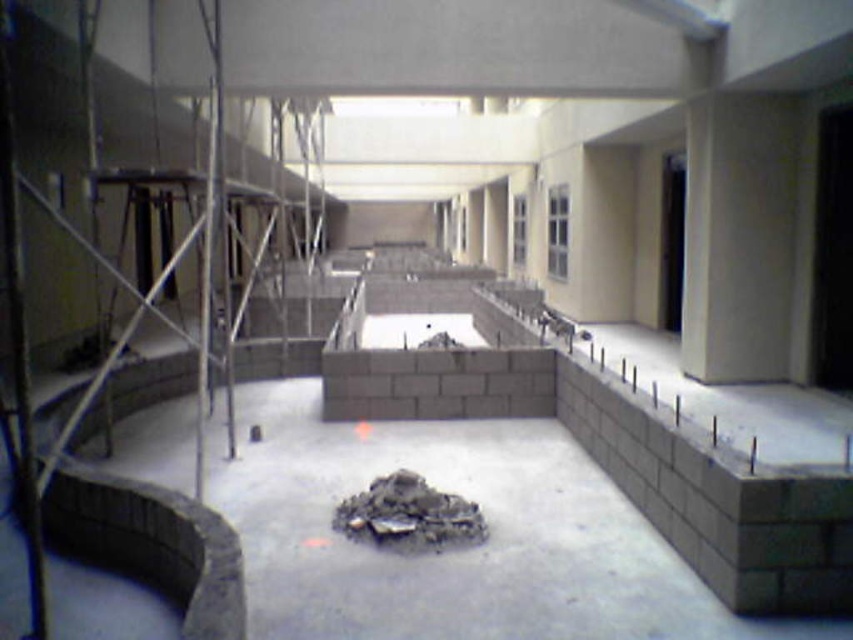
Which is in front, point (26, 284) or point (489, 358)?

Positioned in front is point (489, 358).

Consider the image. Which is below, metal scaffolding at left or gray concrete block at center?

Positioned lower is gray concrete block at center.

Is point (268, 172) less distant than point (437, 371)?

No, it is behind (437, 371).

What are the coordinates of `metal scaffolding at left` in the screenshot? It's located at (44, 88).